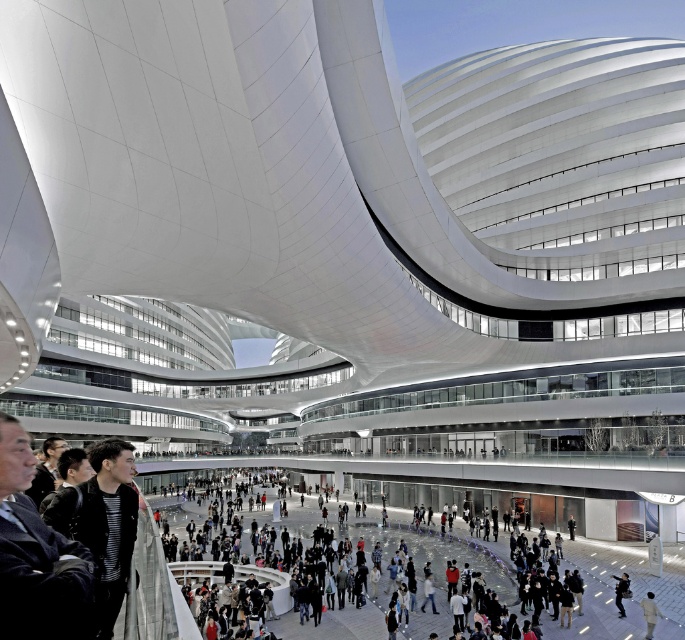
Question: Which of the following is the farthest from the observer?

Choices:
 (A) white matte jacket at lower center
 (B) dark gray fabric jacket at lower center

Answer: (B)

Question: In this image, where is white matte jacket at lower center located relative to dark gray fabric jacket at lower center?

Choices:
 (A) above
 (B) below

Answer: (A)

Question: Among these objects, which one is farthest from the camera?

Choices:
 (A) dark gray fabric jacket at lower center
 (B) white matte jacket at lower center

Answer: (A)

Question: Is white matte jacket at lower center positioned at the back of dark gray fabric jacket at lower center?

Choices:
 (A) no
 (B) yes

Answer: (A)

Question: From the image, what is the correct spatial relationship of white matte jacket at lower center in relation to dark gray fabric jacket at lower center?

Choices:
 (A) above
 (B) below

Answer: (A)